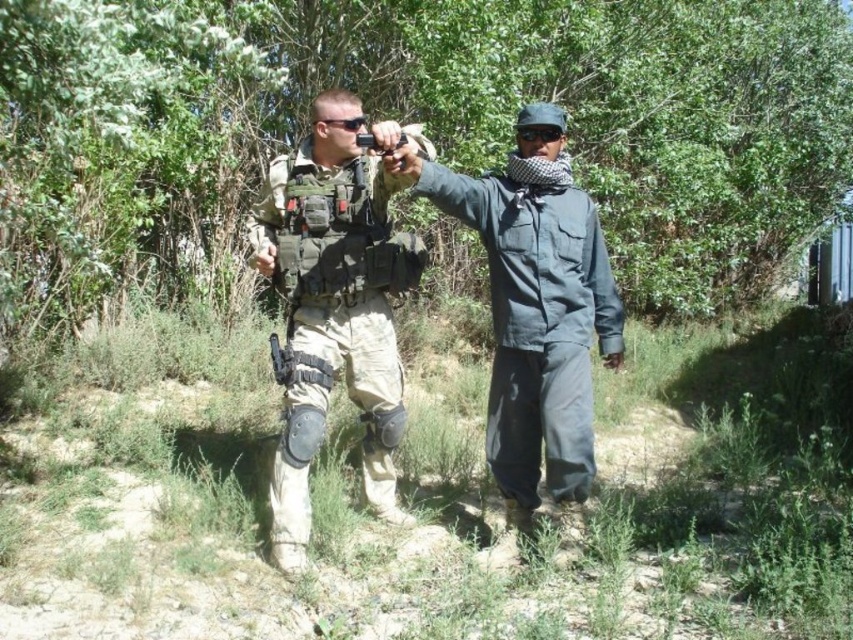
Which is above, tan/camouflage uniform at center or dark blue uniform at center?

dark blue uniform at center

Where is `tan/camouflage uniform at center`? tan/camouflage uniform at center is located at coordinates (329, 310).